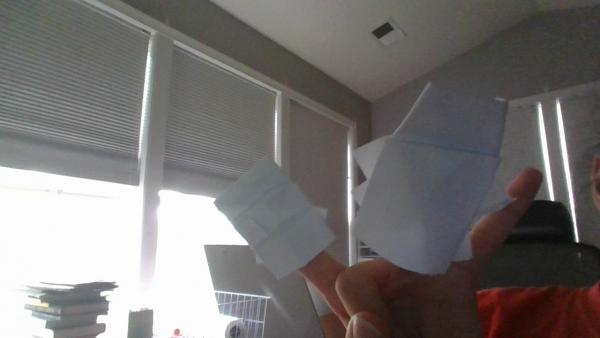
Where is `ceiling`? Image resolution: width=600 pixels, height=338 pixels. ceiling is located at coordinates (456, 32).